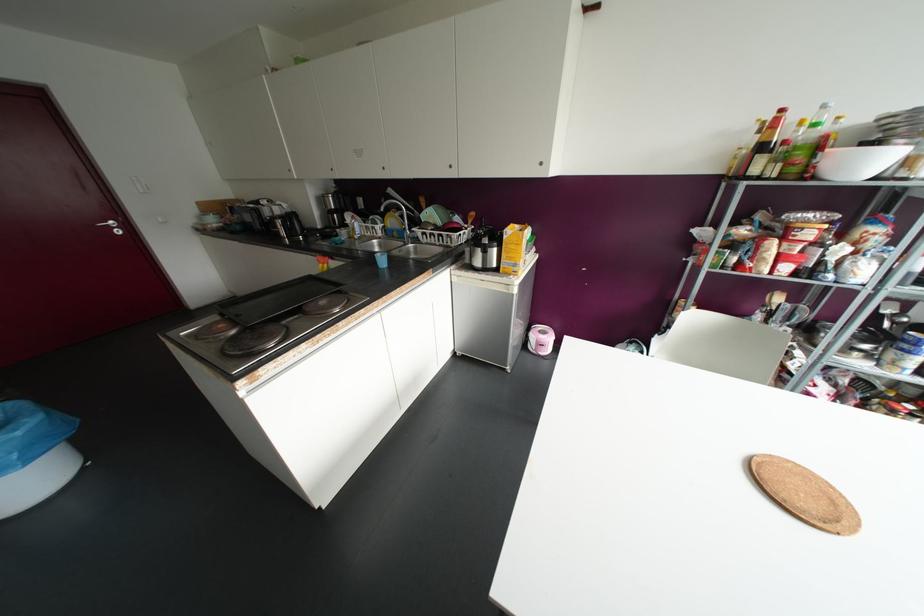
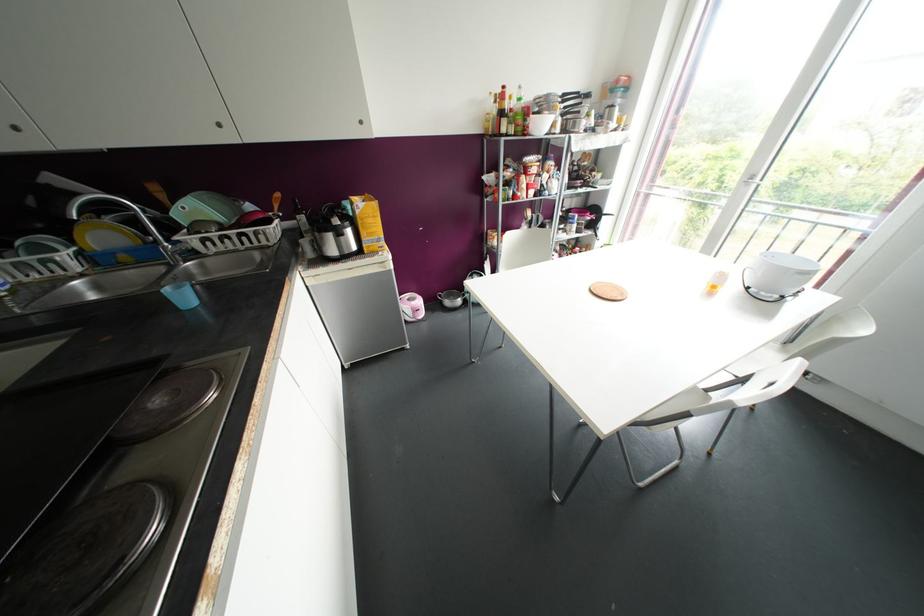
Find the pixel in the second image that matches [450,166] in the first image.

(219, 124)